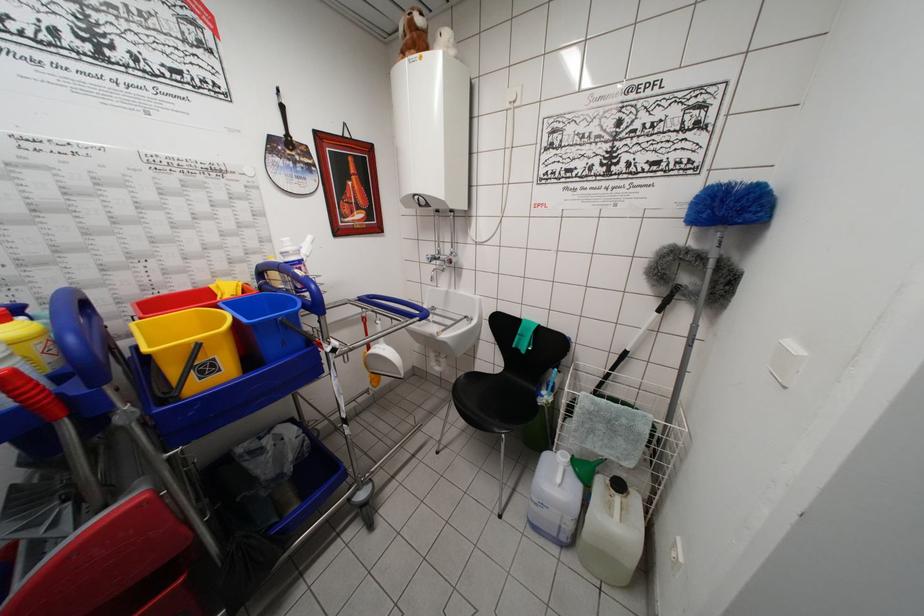
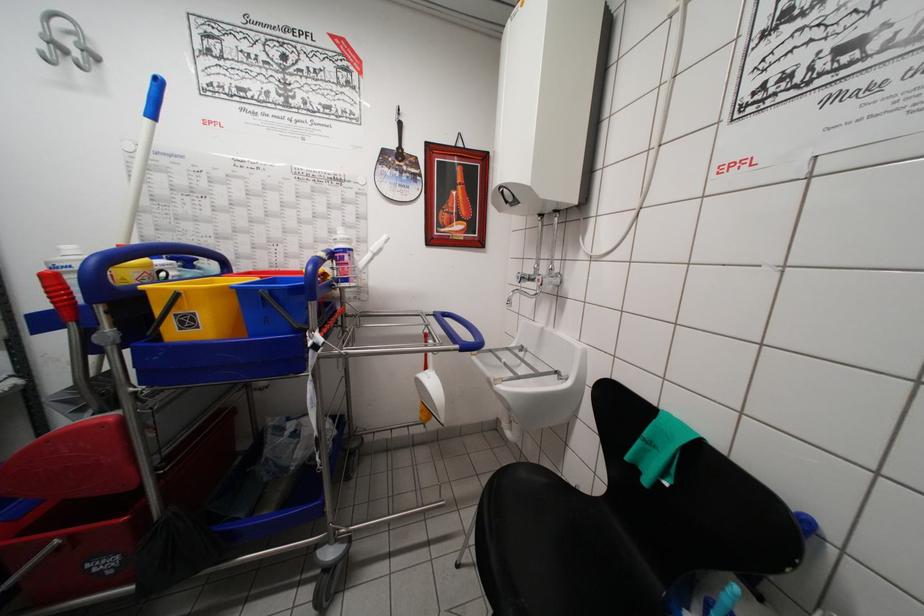
Find the pixel in the second image that matches (x=432, y=262) in the first image.

(521, 282)